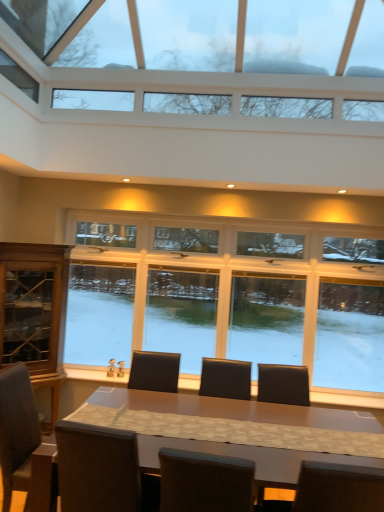
Question: Which direction should I rotate to look at clear glass windows at upper center, marked as the 2th window in a back-to-front arrangement, — up or down?

Choices:
 (A) up
 (B) down

Answer: (A)

Question: Does matte brown table at center have a greater width compared to clear glass windows at center, marked as the 2th window in a front-to-back arrangement?

Choices:
 (A) yes
 (B) no

Answer: (A)

Question: Can you confirm if matte brown table at center is bigger than clear glass windows at center, the second window from the top?

Choices:
 (A) yes
 (B) no

Answer: (A)

Question: Is matte brown table at center positioned behind clear glass windows at center, marked as the 2th window in a front-to-back arrangement?

Choices:
 (A) no
 (B) yes

Answer: (A)

Question: Is matte brown table at center not inside clear glass windows at center, the 1th window from the bottom?

Choices:
 (A) yes
 (B) no

Answer: (A)

Question: Does matte brown table at center have a smaller size compared to clear glass windows at center, the 1th window from the bottom?

Choices:
 (A) yes
 (B) no

Answer: (B)

Question: Is there a large distance between matte brown table at center and clear glass windows at center, the second window from the top?

Choices:
 (A) yes
 (B) no

Answer: (A)

Question: Is matte brown table at center at the left side of dark brown leather chair at lower left?

Choices:
 (A) yes
 (B) no

Answer: (B)

Question: Can you confirm if matte brown table at center is shorter than dark brown leather chair at lower left?

Choices:
 (A) yes
 (B) no

Answer: (A)

Question: Is matte brown table at center facing towards dark brown leather chair at lower left?

Choices:
 (A) yes
 (B) no

Answer: (B)

Question: Does matte brown table at center contain dark brown leather chair at lower left?

Choices:
 (A) no
 (B) yes

Answer: (A)

Question: Is matte brown table at center positioned far away from dark brown leather chair at lower left?

Choices:
 (A) no
 (B) yes

Answer: (A)

Question: Is matte brown table at center next to dark brown leather chair at lower left and touching it?

Choices:
 (A) no
 (B) yes

Answer: (A)

Question: Is clear glass windows at upper center, which is counted as the first window, starting from the front, beside dark brown leather armchair at center?

Choices:
 (A) no
 (B) yes

Answer: (A)